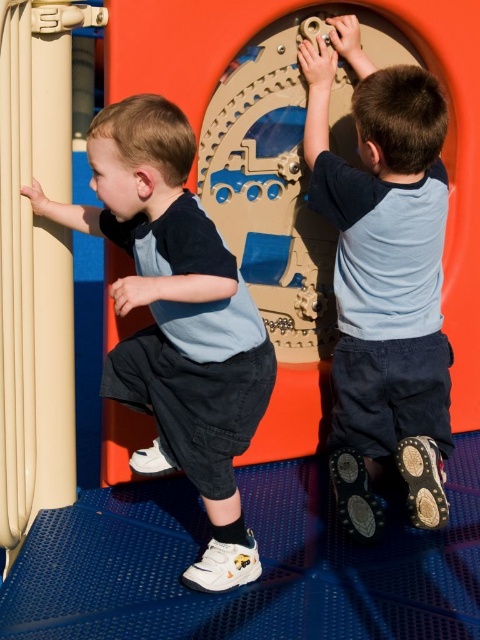
Does point (69, 225) lie in front of point (156, 38)?

No, it is not.

Between matte blue shirt at left and smooth orange slide at center, which one is positioned lower?

Positioned lower is matte blue shirt at left.

At what (x,y) coordinates should I click in order to perform the action: click on matte blue shirt at left. Please return your answer as a coordinate pair (x, y). Looking at the image, I should click on (178, 321).

Locate an element on the screen. matte blue shirt at left is located at coordinates (178, 321).

Between light blue t-shirt at upper right and smooth orange slide at center, which one appears on the left side from the viewer's perspective?

Positioned to the left is light blue t-shirt at upper right.

Is light blue t-shirt at upper right thinner than smooth orange slide at center?

Yes.

Between point (400, 230) and point (195, 74), which one is positioned behind?

Point (400, 230)

I want to click on light blue t-shirt at upper right, so click(x=384, y=278).

Is light blue t-shirt at upper right closer to the viewer compared to matte blue shirt at left?

No.

The image size is (480, 640). Describe the element at coordinates (384, 278) in the screenshot. I see `light blue t-shirt at upper right` at that location.

Measure the distance between point (x=424, y=502) and camera.

Point (x=424, y=502) is 2.99 meters from camera.

Find the location of a particular element. This screenshot has width=480, height=640. light blue t-shirt at upper right is located at coordinates (384, 278).